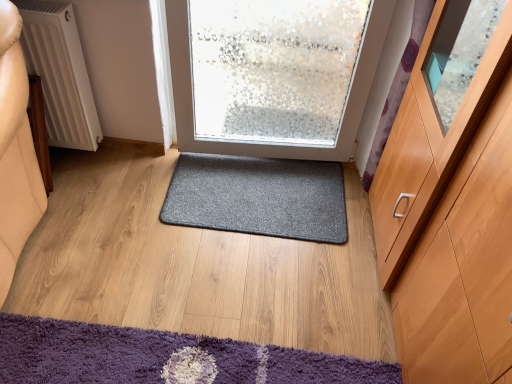
Question: Is point (186, 168) positioned closer to the camera than point (410, 82)?

Choices:
 (A) closer
 (B) farther

Answer: (B)

Question: In the image, is dark gray carpet at center, positioned as the 1th mat in back-to-front order, positioned in front of or behind light brown wood cabinet at right?

Choices:
 (A) front
 (B) behind

Answer: (B)

Question: Estimate the real-world distances between objects in this image. Which object is closer to the light brown wood cabinet at right?

Choices:
 (A) white textured radiator at left
 (B) dark gray carpet at center, placed as the first mat when sorted from top to bottom
 (C) purple shaggy mat at lower left, which is the 1th mat in bottom-to-top order

Answer: (C)

Question: Estimate the real-world distances between objects in this image. Which object is closer to the dark gray carpet at center, placed as the first mat when sorted from top to bottom?

Choices:
 (A) white textured radiator at left
 (B) light brown wood cabinet at right
 (C) purple shaggy mat at lower left, the second mat positioned from the top

Answer: (C)